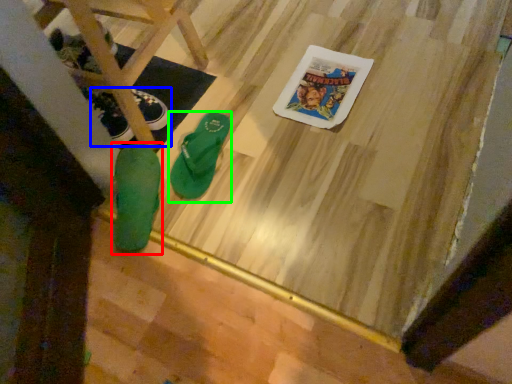
Question: Which is nearer to the footwear (highlighted by a red box)? footwear (highlighted by a blue box) or footwear (highlighted by a green box).

Choices:
 (A) footwear
 (B) footwear

Answer: (B)